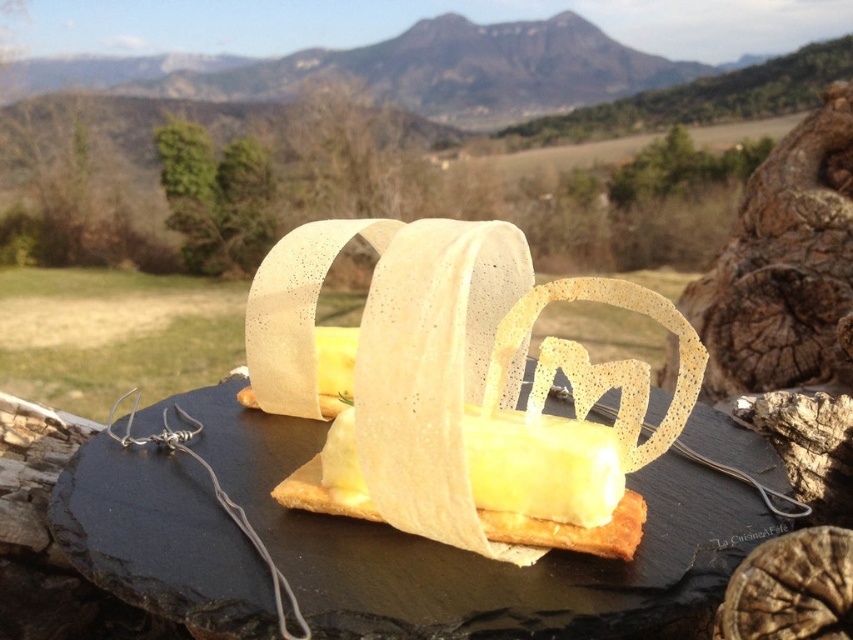
Question: Observing the image, what is the correct spatial positioning of translucent paper crown at center in reference to rough bark tree trunk at right?

Choices:
 (A) below
 (B) above

Answer: (A)

Question: Is translucent paper crown at center to the left of rough bark tree trunk at right from the viewer's perspective?

Choices:
 (A) yes
 (B) no

Answer: (A)

Question: Which point is closer to the camera taking this photo?

Choices:
 (A) (737, 378)
 (B) (680, 388)

Answer: (B)

Question: Does translucent paper crown at center have a smaller size compared to rough bark tree trunk at right?

Choices:
 (A) no
 (B) yes

Answer: (A)

Question: Which point is closer to the camera?

Choices:
 (A) translucent paper crown at center
 (B) rough bark tree trunk at right

Answer: (A)